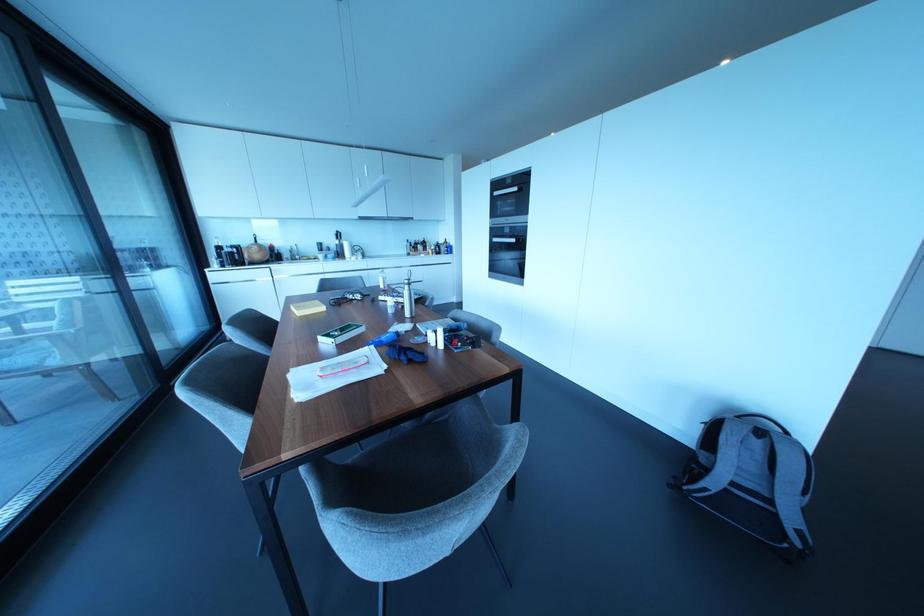
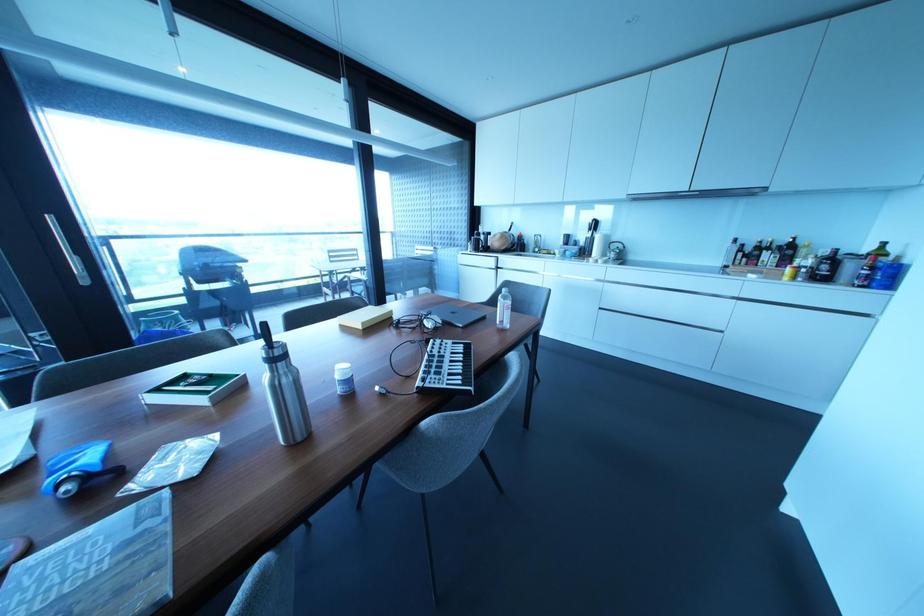
Find the pixel in the second image that matches pixel 356 248 in the first image.

(614, 245)